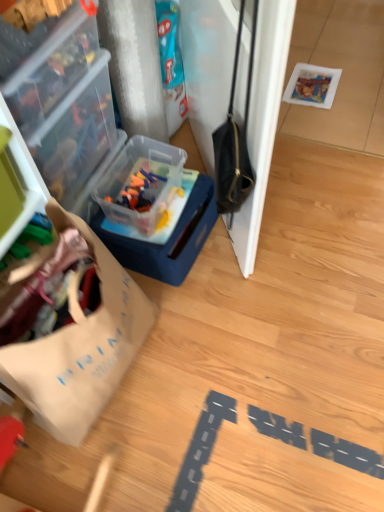
Question: From the image's perspective, is transparent plastic container at upper left, acting as the second box starting from the right, located above or below translucent plastic container at center-left, the 2th box from the left?

Choices:
 (A) above
 (B) below

Answer: (A)

Question: Choose the correct answer: Is transparent plastic container at upper left, acting as the second box starting from the right, inside translucent plastic container at center-left, the 2th box from the left, or outside it?

Choices:
 (A) inside
 (B) outside

Answer: (B)

Question: Which is nearer to the translucent plastic container at center-left, which appears as the 1th box when viewed from the right?

Choices:
 (A) transparent plastic container at upper left, acting as the second box starting from the right
 (B) wooden floor at lower center
 (C) brown paper bag at left

Answer: (A)

Question: Estimate the real-world distances between objects in this image. Which object is farther from the wooden floor at lower center?

Choices:
 (A) brown paper bag at left
 (B) transparent plastic container at upper left, marked as the 1th box in a left-to-right arrangement
 (C) translucent plastic container at center-left, the 2th box from the left

Answer: (B)